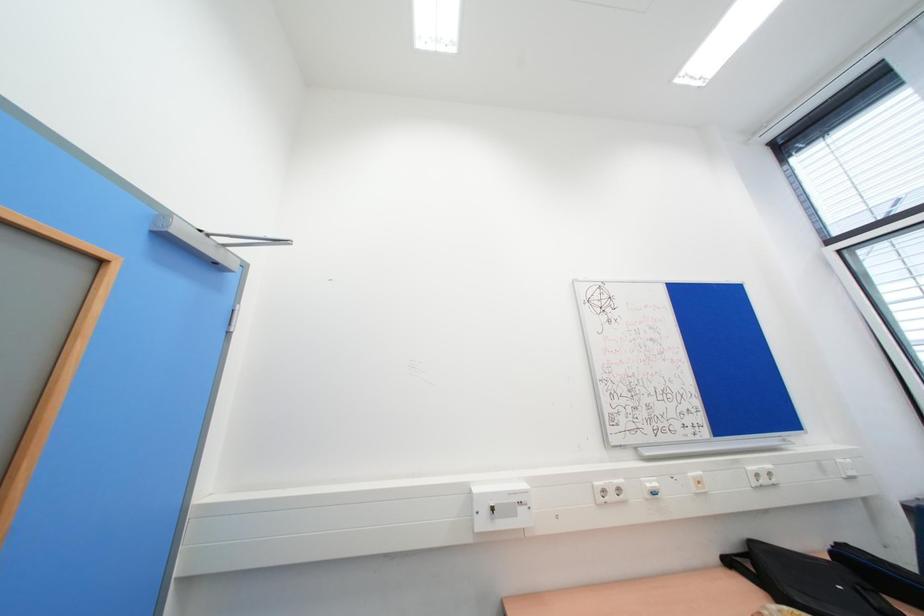
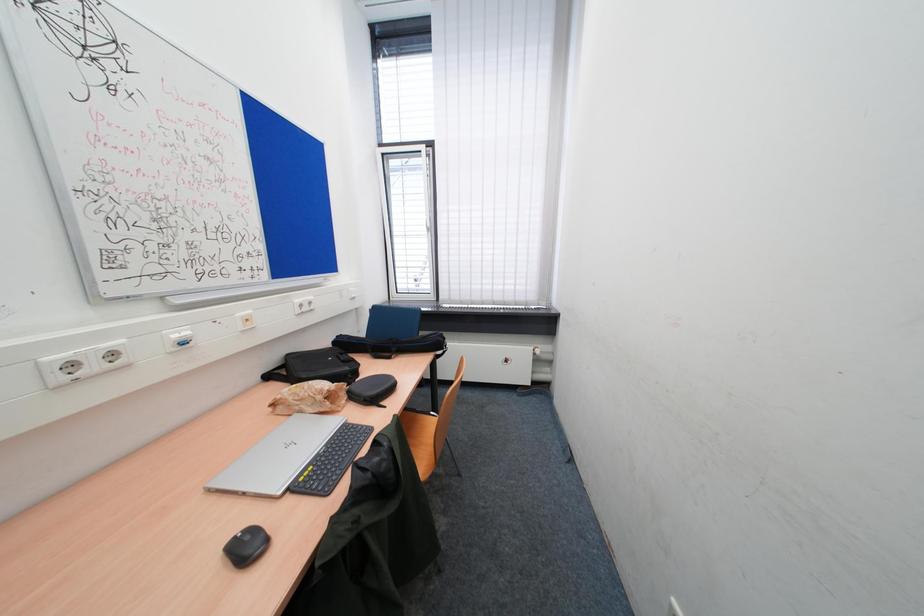
Question: Based on the continuous images, in which direction is the camera rotating? Reply with the corresponding letter.

Choices:
 (A) Left
 (B) Right
 (C) Up
 (D) Down

Answer: (B)